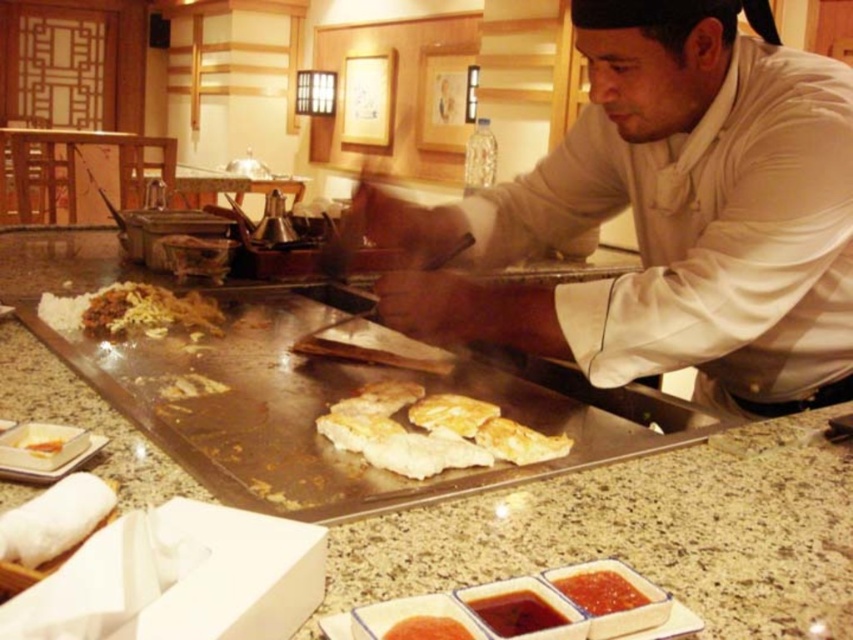
You are a customer sitting at the teppanyaki counter and want to point out two specific points on the griddle to the chef. The first point is labeled as point [357,444] and the second is point [636,604]. The chef asks which of these two points is closer to you. Which one should you tell them?

Point [357,444] is closer to you because it is further to the viewer than point [636,604].

In the Japanese teppanyaki restaurant scene, you see a golden crispy chicken at center and a smooth tomato sauce at lower center. Which object takes up more space in the image?

The golden crispy chicken at center takes up more space in the image because it is bigger than the smooth tomato sauce at lower center.

You are a customer sitting at the teppanyaki counter. The chef is cooking on a large griddle. There is a point marked at coordinates (601, 592). What is located at that point?

The point at coordinates (601, 592) corresponds to smooth tomato sauce at lower center.